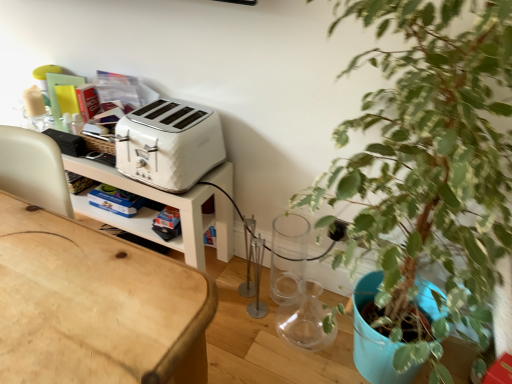
Question: Is green leafy plant at right in front of or behind white plastic toaster at upper center in the image?

Choices:
 (A) behind
 (B) front

Answer: (B)

Question: Is green leafy plant at right inside the boundaries of white plastic toaster at upper center, or outside?

Choices:
 (A) outside
 (B) inside

Answer: (A)

Question: From their relative heights in the image, would you say green leafy plant at right is taller or shorter than white plastic toaster at upper center?

Choices:
 (A) tall
 (B) short

Answer: (A)

Question: From a real-world perspective, is white plastic toaster at upper center positioned above or below green leafy plant at right?

Choices:
 (A) above
 (B) below

Answer: (A)

Question: Based on their sizes in the image, would you say white plastic toaster at upper center is bigger or smaller than green leafy plant at right?

Choices:
 (A) small
 (B) big

Answer: (A)

Question: From the image's perspective, is white plastic toaster at upper center positioned above or below green leafy plant at right?

Choices:
 (A) below
 (B) above

Answer: (B)

Question: Is white plastic toaster at upper center inside or outside of green leafy plant at right?

Choices:
 (A) outside
 (B) inside

Answer: (A)